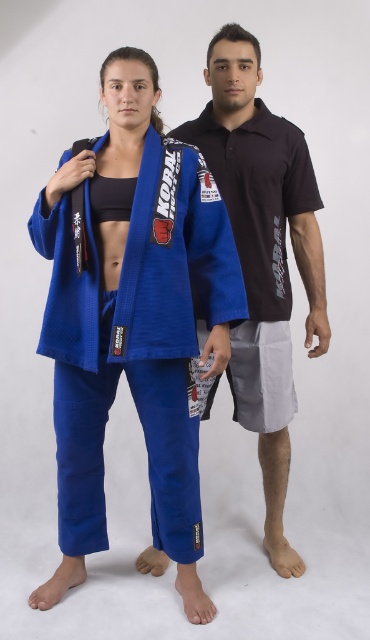
You are a tailor measuring clothing for two customers. You need to determine which garment requires more fabric based on their width. Which one needs more fabric, the blue fabric kimono at center or the matte black polo shirt at center?

The blue fabric kimono at center requires more fabric because its width surpasses that of the matte black polo shirt at center.

Consider the image. You are organizing a martial arts event and need to arrange participants based on their attire. If you see the blue fabric kimono at center and the matte black polo shirt at center in the image, which participant should stand to the right when facing forward?

The matte black polo shirt at center should stand to the right because the blue fabric kimono at center is positioned to the left of it in the image.